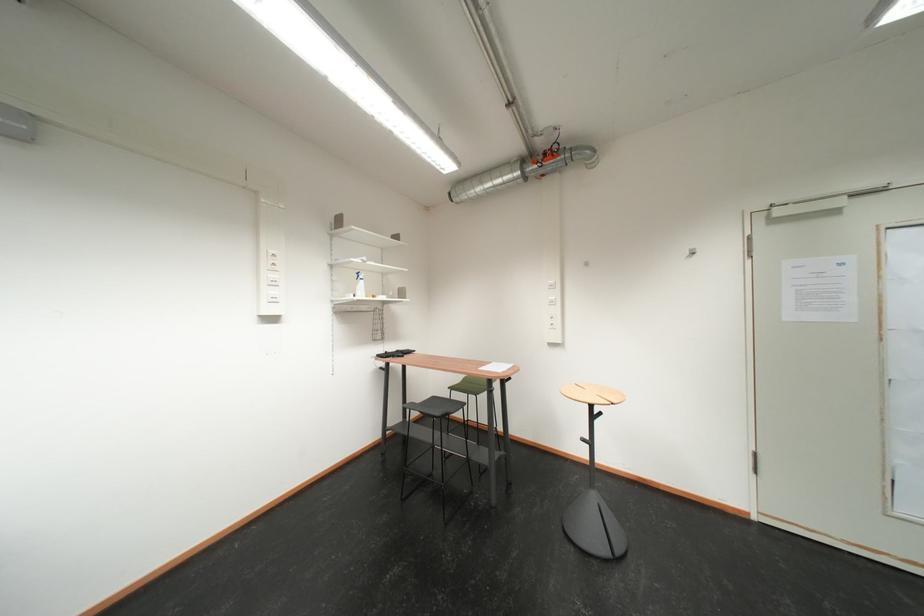
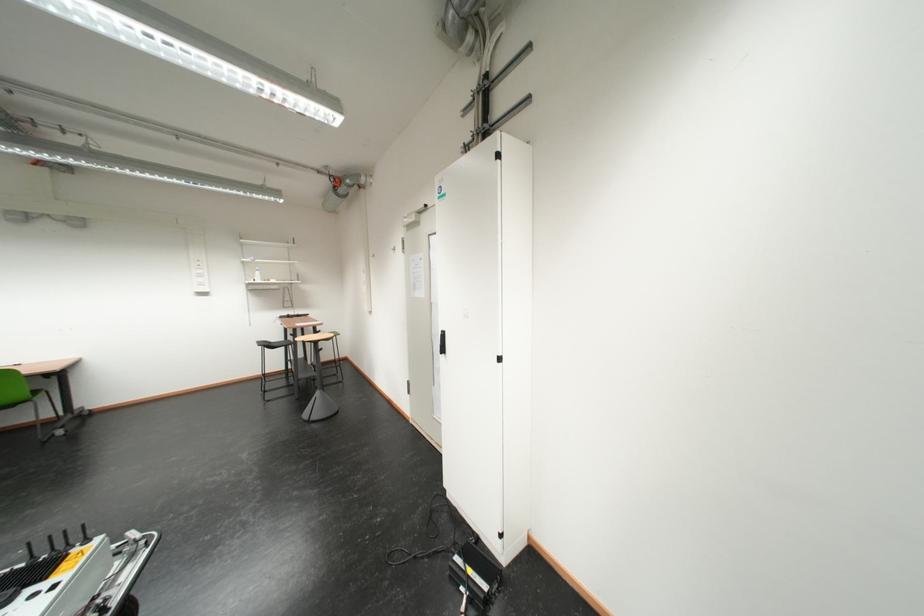
Question: Which direction would the cameraman need to move to produce the second image? Reply with the corresponding letter.

Choices:
 (A) Left
 (B) Right
 (C) Forward
 (D) Backward

Answer: (B)